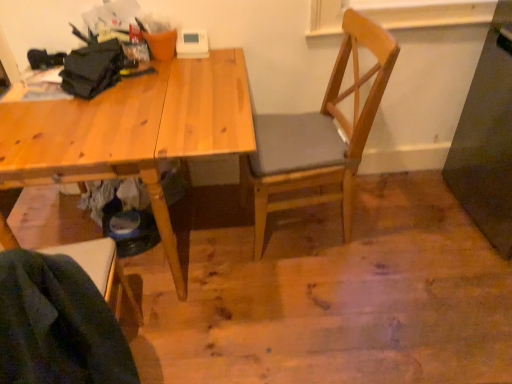
Find the location of a particular element. The width and height of the screenshot is (512, 384). blank space above natural wood desk at upper left (from a real-world perspective) is located at coordinates (103, 105).